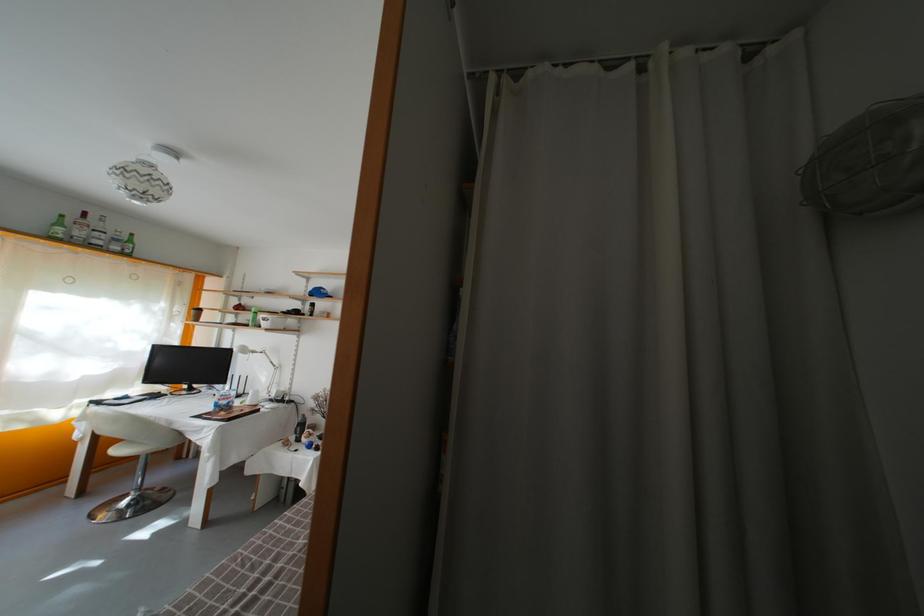
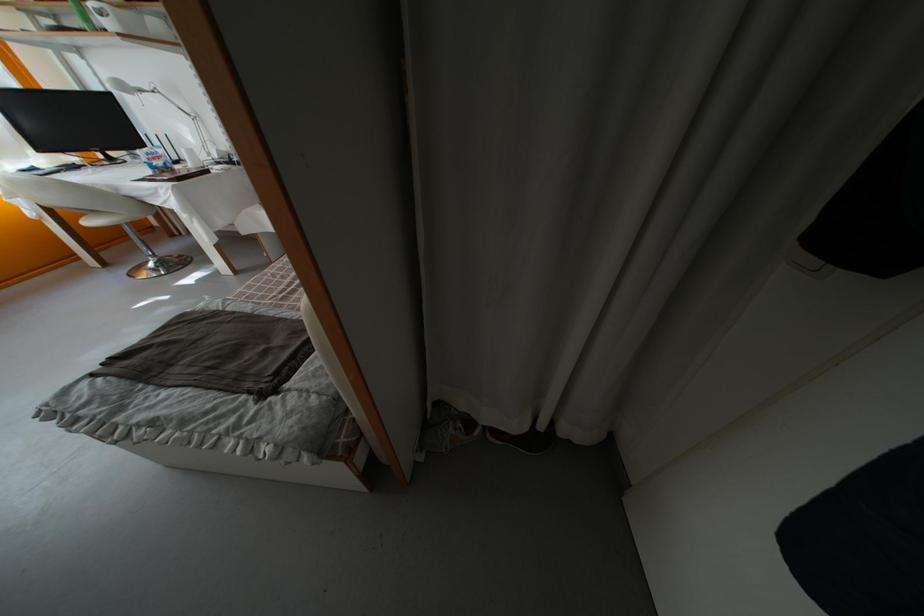
The point at (268, 323) is marked in the first image. Where is the corresponding point in the second image?

(96, 12)